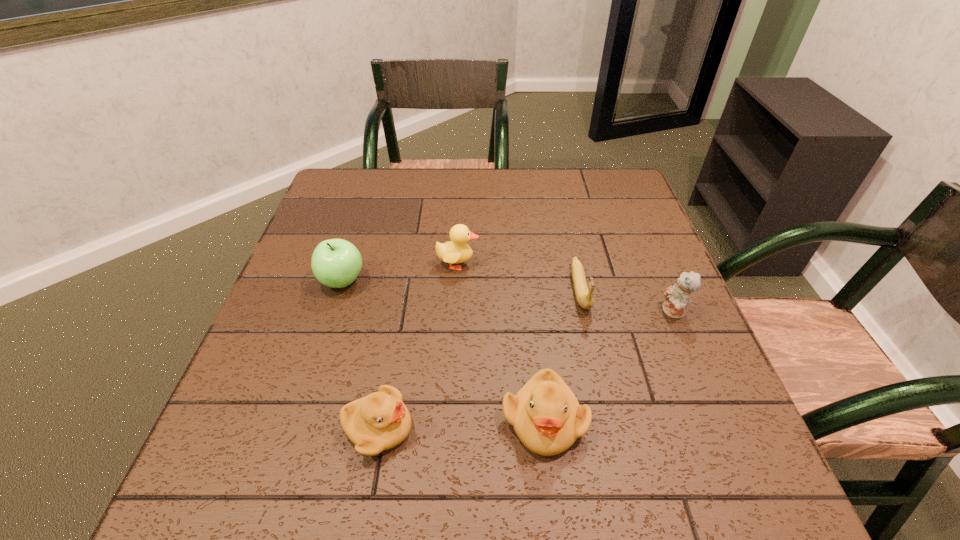
Identify the location of free space located 0.100m at the stem of the banana. (595, 356).

At what (x,y) coordinates should I click in order to perform the action: click on free space located on the right of the apple. Please return your answer as a coordinate pair (x, y). The width and height of the screenshot is (960, 540). Looking at the image, I should click on (450, 281).

Find the location of `free spot located 0.070m on the front-facing side of the teddy bear`. free spot located 0.070m on the front-facing side of the teddy bear is located at coordinates (630, 312).

Where is `vacant space situated 0.300m on the front-facing side of the teddy bear`? This screenshot has height=540, width=960. vacant space situated 0.300m on the front-facing side of the teddy bear is located at coordinates (525, 312).

This screenshot has height=540, width=960. In order to click on vacant space located 0.340m on the front-facing side of the teddy bear in this screenshot , I will do `click(507, 312)`.

You are a GUI agent. You are given a task and a screenshot of the screen. Output one action in this format:
    pyautogui.click(x=<x>, y=<y>)
    Task: Click on the object that is at the left edge
    
    Given the screenshot: What is the action you would take?
    pyautogui.click(x=336, y=263)

At what (x,y) coordinates should I click in order to perform the action: click on object that is at the right edge. Please return your answer as a coordinate pair (x, y). Looking at the image, I should click on (677, 297).

In the image, there is a desktop. At what (x,y) coordinates should I click in order to perform the action: click on free region at the far edge. Please return your answer as a coordinate pair (x, y). This screenshot has width=960, height=540. Looking at the image, I should click on (514, 183).

You are a GUI agent. You are given a task and a screenshot of the screen. Output one action in this format:
    pyautogui.click(x=<x>, y=<y>)
    Task: Click on the vacant space at the near edge of the desktop
    This screenshot has width=960, height=540.
    Given the screenshot: What is the action you would take?
    pyautogui.click(x=633, y=401)

At what (x,y) coordinates should I click in order to perform the action: click on vacant space at the left edge. Please return your answer as a coordinate pair (x, y). Image resolution: width=960 pixels, height=540 pixels. Looking at the image, I should click on (351, 240).